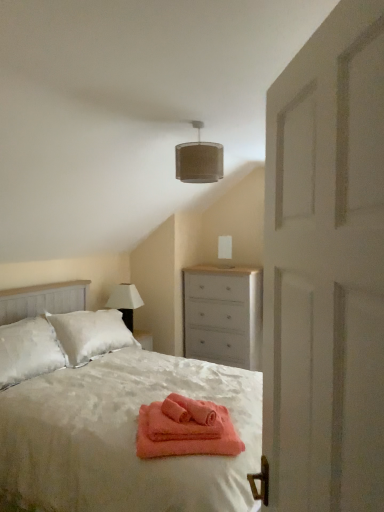
Locate an element on the screen. free space above beige fabric lampshade at upper center (from a real-world perspective) is located at coordinates (210, 120).